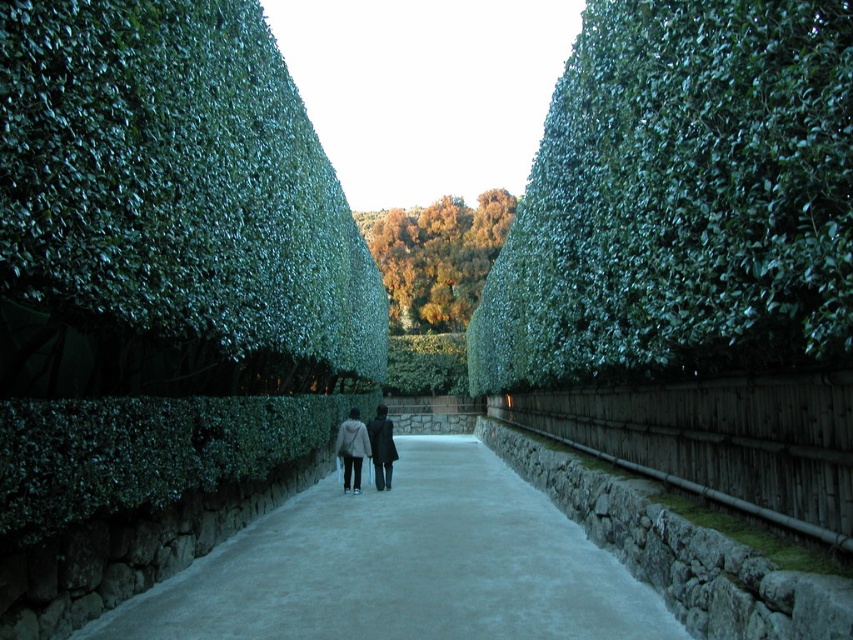
You are walking along the pathway and notice two plants at the center. The green leafy hedge at center and the golden textured foliage at center. Which one is closer to you as you walk forward?

The green leafy hedge at center is closer to you because it is in front of the golden textured foliage at center.

You are standing at the entrance of the pathway and want to walk towards the green leafy hedge at center. Based on the image, in which direction should you move relative to the pathway?

Since the green leafy hedge at center is located at coordinates 0.312 on the x axis and 0.800 on the y axis, you should move forward along the pathway towards the center to reach it.